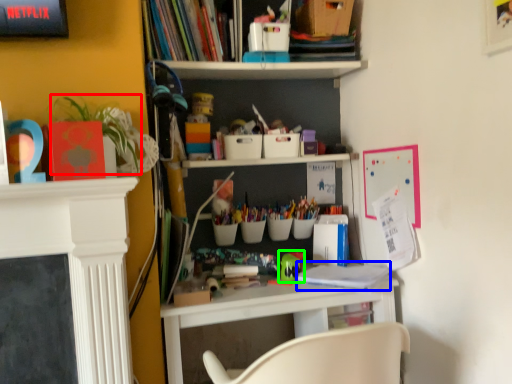
Question: Estimate the real-world distances between objects in this image. Which object is farther from plant (highlighted by a red box), book (highlighted by a blue box) or toy (highlighted by a green box)?

Choices:
 (A) book
 (B) toy

Answer: (A)